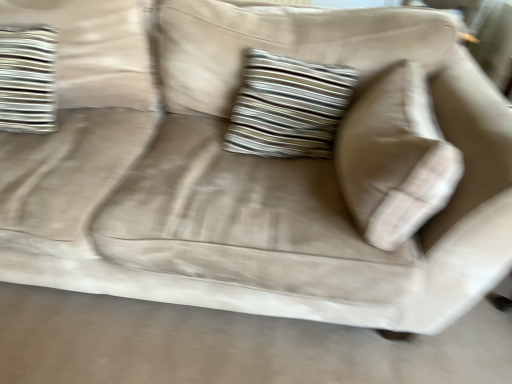
Identify the location of striped fabric pillow at center. This screenshot has width=512, height=384. (288, 107).

What do you see at coordinates (288, 107) in the screenshot?
I see `striped fabric pillow at center` at bounding box center [288, 107].

Where is `striped fabric pillow at center`? striped fabric pillow at center is located at coordinates (288, 107).